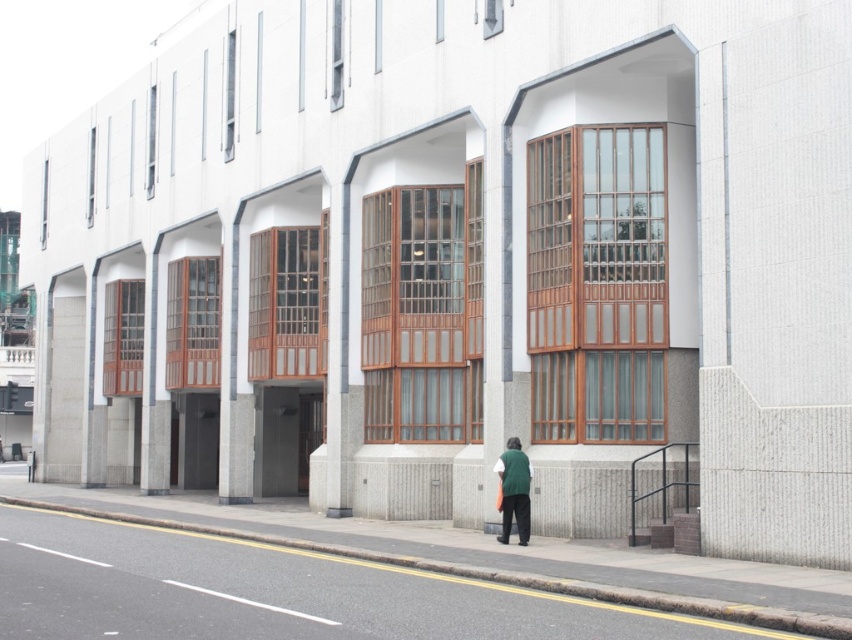
Question: Is gray concrete curb at lower left to the right of green fabric bag at lower center from the viewer's perspective?

Choices:
 (A) no
 (B) yes

Answer: (A)

Question: Which point is closer to the camera?

Choices:
 (A) gray concrete curb at lower left
 (B) green fabric bag at lower center

Answer: (A)

Question: Which point appears farthest from the camera in this image?

Choices:
 (A) (38, 504)
 (B) (515, 488)

Answer: (A)

Question: Which of the following is the farthest from the observer?

Choices:
 (A) green fabric bag at lower center
 (B) gray concrete curb at lower left

Answer: (A)

Question: Is gray concrete curb at lower left to the left of green fabric bag at lower center from the viewer's perspective?

Choices:
 (A) yes
 (B) no

Answer: (A)

Question: Can you confirm if gray concrete curb at lower left is positioned above green fabric bag at lower center?

Choices:
 (A) no
 (B) yes

Answer: (A)